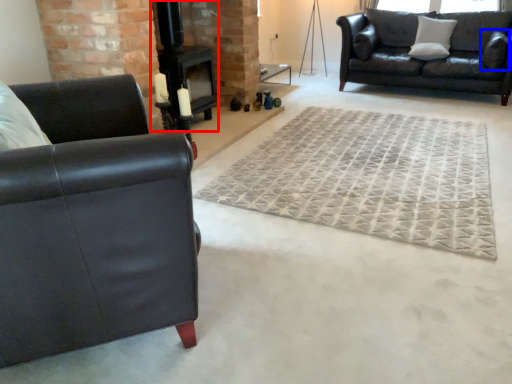
Question: Which point is closer to the camera, fireplace (highlighted by a red box) or pillow (highlighted by a blue box)?

Choices:
 (A) fireplace
 (B) pillow

Answer: (A)